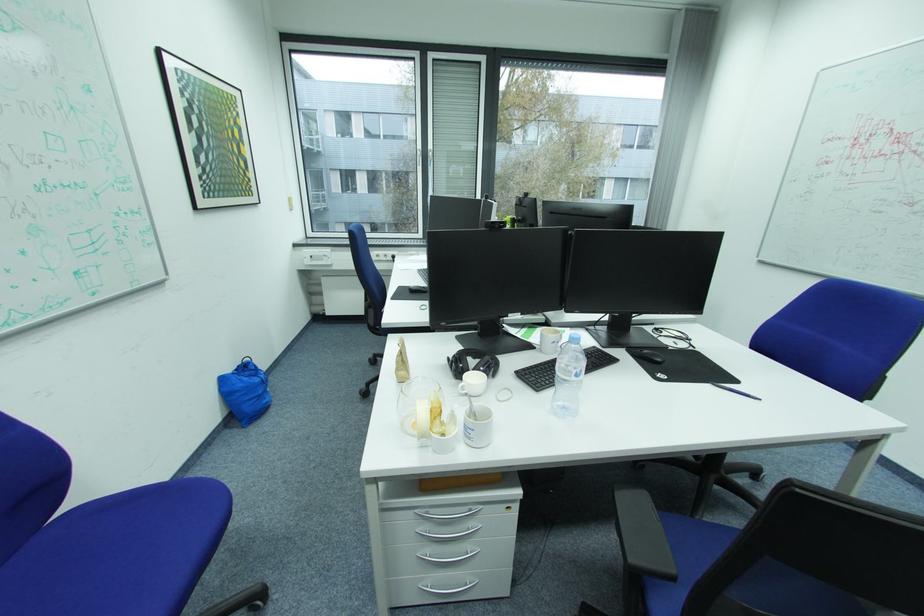
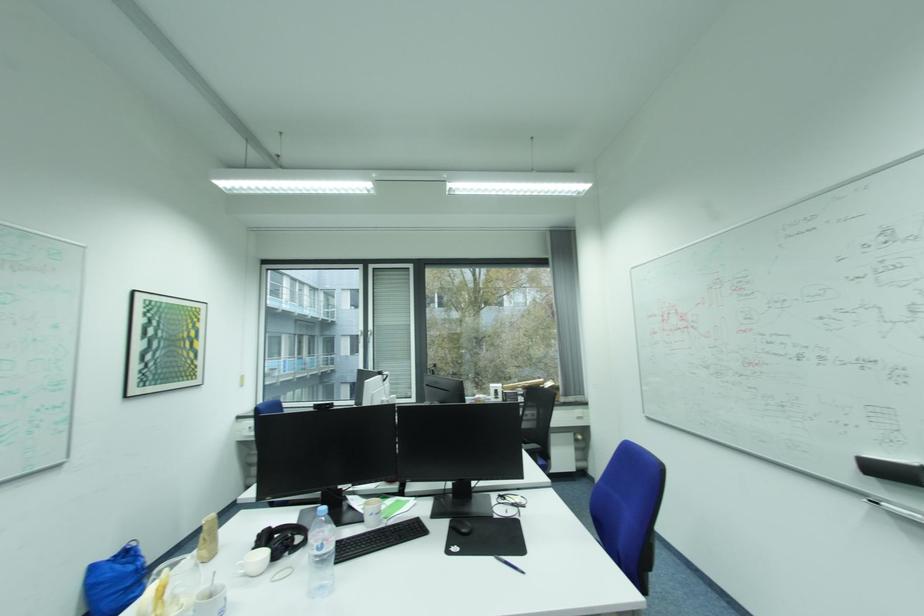
Question: The images are taken continuously from a first-person perspective. In which direction is your viewpoint rotating?

Choices:
 (A) Left
 (B) Right
 (C) Up
 (D) Down

Answer: (C)